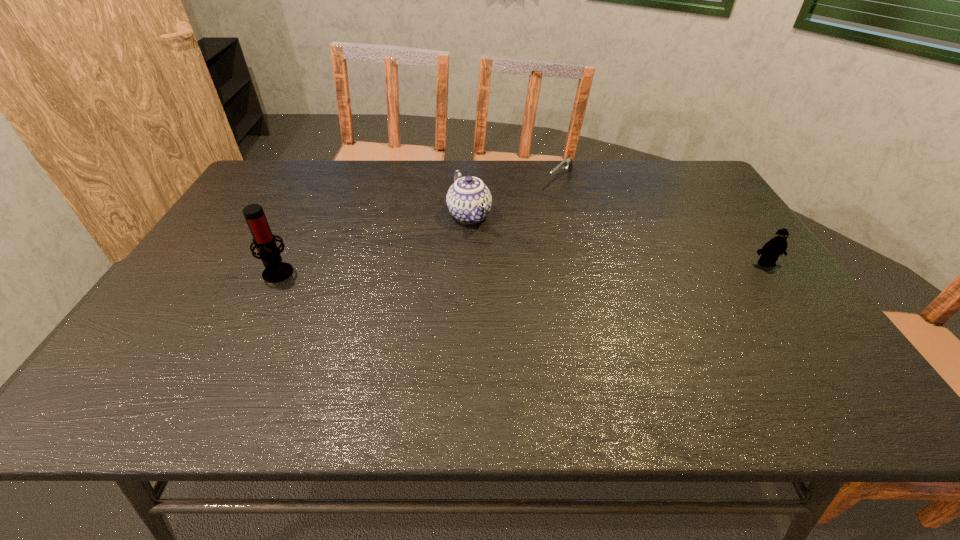
At what (x,y) coordinates should I click in order to perform the action: click on vacant space at the near edge of the desktop. Please return your answer as a coordinate pair (x, y). The image size is (960, 540). Looking at the image, I should click on (420, 342).

This screenshot has height=540, width=960. I want to click on vacant region at the left edge, so click(248, 269).

Find the location of a particular element. The image size is (960, 540). blank area at the right edge is located at coordinates (750, 244).

At what (x,y) coordinates should I click in order to perform the action: click on vacant region at the far left corner. Please return your answer as a coordinate pair (x, y). The height and width of the screenshot is (540, 960). Looking at the image, I should click on (277, 184).

You are a GUI agent. You are given a task and a screenshot of the screen. Output one action in this format:
    pyautogui.click(x=<x>, y=<y>)
    Task: Click on the free space at the near left corner of the desktop
    This screenshot has height=540, width=960.
    Given the screenshot: What is the action you would take?
    pyautogui.click(x=183, y=355)

You are a GUI agent. You are given a task and a screenshot of the screen. Output one action in this format:
    pyautogui.click(x=<x>, y=<y>)
    Task: Click on the vacant space at the near right corner
    This screenshot has width=960, height=540.
    Given the screenshot: What is the action you would take?
    pyautogui.click(x=818, y=339)

Locate an element on the screen. empty space between the rightmost object and the second farthest object is located at coordinates (617, 239).

Find the location of a particular element. The width and height of the screenshot is (960, 540). free spot between the second object from right to left and the leftmost object is located at coordinates (419, 226).

Image resolution: width=960 pixels, height=540 pixels. Identify the location of free space between the tallest object and the rightmost object. (521, 268).

Find the location of `free area in between the second shortest object and the second farthest object`. free area in between the second shortest object and the second farthest object is located at coordinates (617, 239).